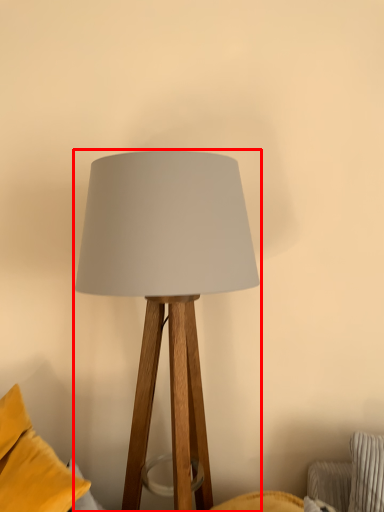
Question: From the image's perspective, what is the correct spatial positioning of lamp (annotated by the red box) in reference to pillow?

Choices:
 (A) above
 (B) below

Answer: (A)